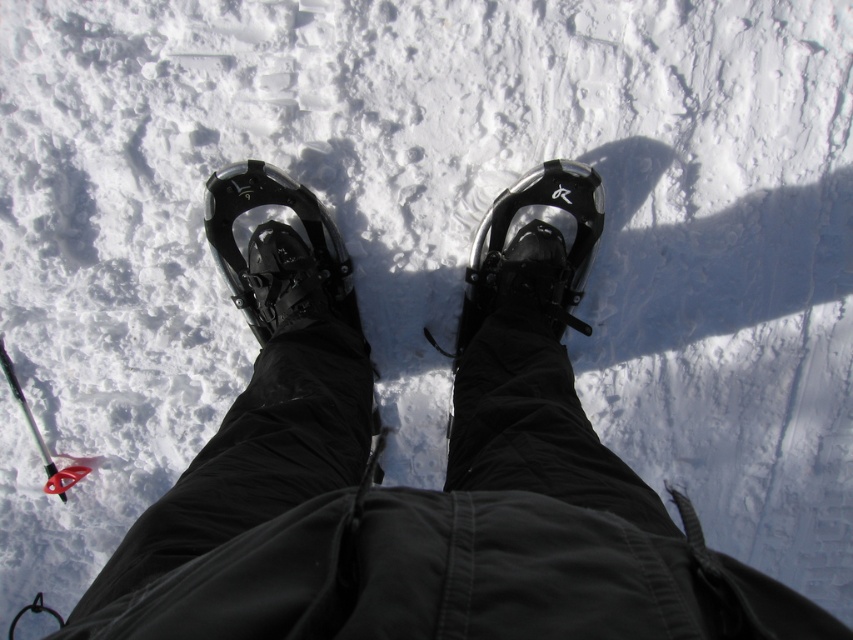
Question: Can you confirm if black matte snowshoes at center is bigger than black glossy snowshoe at center?

Choices:
 (A) yes
 (B) no

Answer: (A)

Question: Which point is farther to the camera?

Choices:
 (A) black matte snowshoes at center
 (B) black glossy snowshoe at center

Answer: (B)

Question: In this image, where is black matte snowshoes at center located relative to black glossy snowshoe at center?

Choices:
 (A) right
 (B) left

Answer: (A)

Question: Does black matte snowshoes at center lie in front of black glossy snowshoe at center?

Choices:
 (A) no
 (B) yes

Answer: (B)

Question: Among these points, which one is farthest from the camera?

Choices:
 (A) (438, 608)
 (B) (259, 193)

Answer: (B)